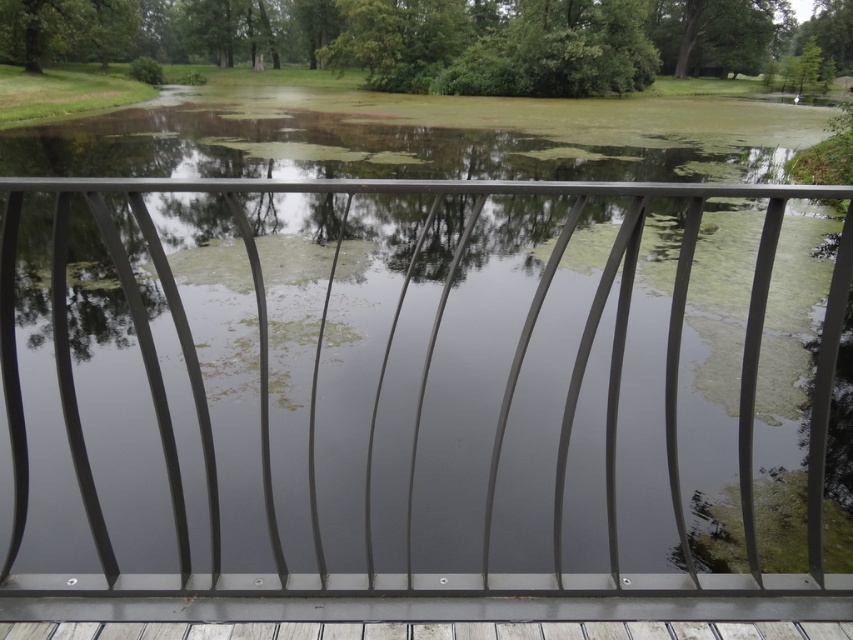
Question: Does green leafy tree at upper center have a smaller size compared to green leafy tree at upper left?

Choices:
 (A) no
 (B) yes

Answer: (A)

Question: Does green leafy tree at upper center have a lesser width compared to green leafy tree at upper left?

Choices:
 (A) yes
 (B) no

Answer: (B)

Question: Does green leafy tree at upper center appear over green leafy tree at upper left?

Choices:
 (A) no
 (B) yes

Answer: (B)